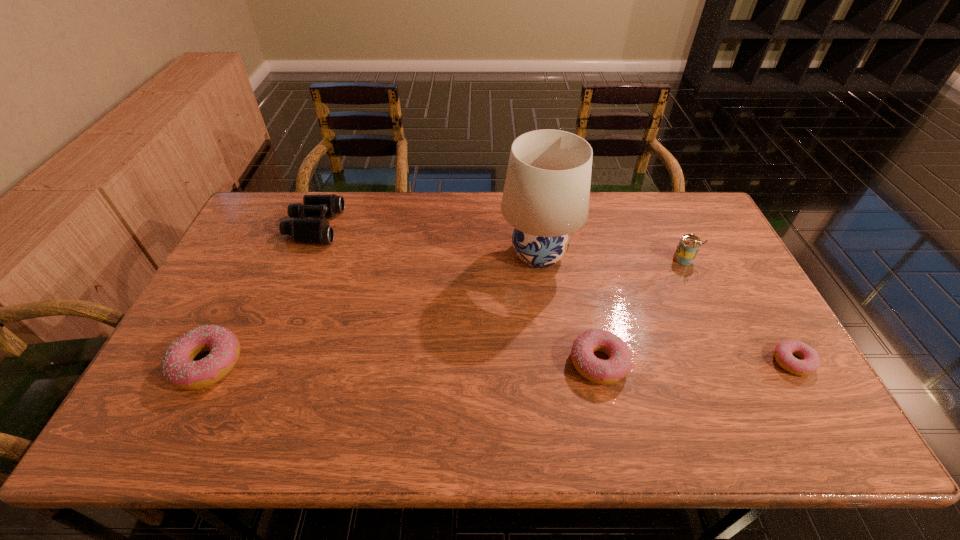
Where is `the leftmost doughnut`? The image size is (960, 540). the leftmost doughnut is located at coordinates (178, 366).

Where is `the second tallest doughnut`? the second tallest doughnut is located at coordinates (599, 371).

This screenshot has height=540, width=960. I want to click on the second doughnut from left to right, so click(599, 371).

The width and height of the screenshot is (960, 540). Find the location of `the shortest doughnut`. the shortest doughnut is located at coordinates (810, 362).

Where is `the shortest object`? The image size is (960, 540). the shortest object is located at coordinates (810, 362).

What are the coordinates of `binoculars` in the screenshot? It's located at (309, 231).

Identify the location of the tallest object. This screenshot has width=960, height=540. (546, 195).

This screenshot has width=960, height=540. In order to click on the fifth shortest object in this screenshot , I will do `click(689, 245)`.

Locate an element on the screen. This screenshot has height=540, width=960. the fifth object from left to right is located at coordinates (689, 245).

Locate an element on the screen. The image size is (960, 540). vacant space located on the right of the leftmost doughnut is located at coordinates (270, 364).